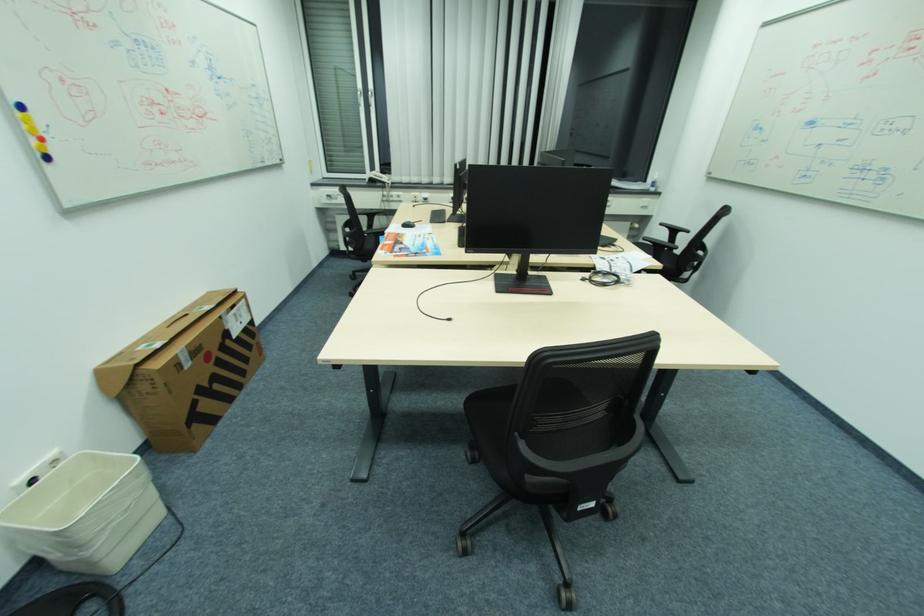
The location [86,513] corresponds to which object?

It refers to a white trash can.